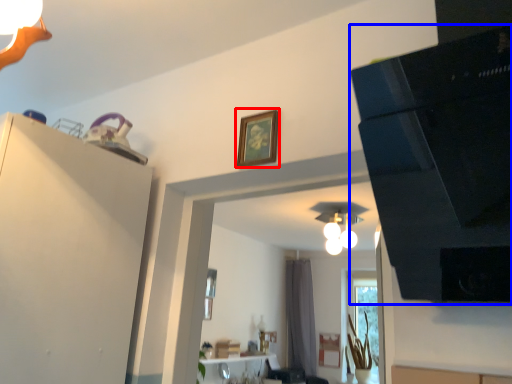
Question: Which of the following is the closest to the observer, picture frame (highlighted by a red box) or appliance (highlighted by a blue box)?

Choices:
 (A) picture frame
 (B) appliance

Answer: (B)